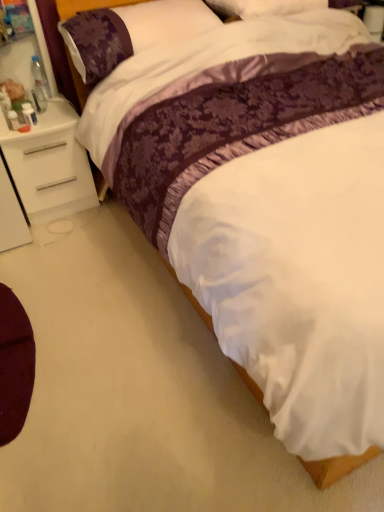
Question: Is maroon fabric cushion at lower left aimed at white matte nightstand at left?

Choices:
 (A) yes
 (B) no

Answer: (B)

Question: From the image's perspective, is maroon fabric cushion at lower left over white matte nightstand at left?

Choices:
 (A) yes
 (B) no

Answer: (B)

Question: Is maroon fabric cushion at lower left taller than white matte nightstand at left?

Choices:
 (A) yes
 (B) no

Answer: (B)

Question: Does maroon fabric cushion at lower left come in front of white matte nightstand at left?

Choices:
 (A) no
 (B) yes

Answer: (B)

Question: Is white matte nightstand at left at the back of maroon fabric cushion at lower left?

Choices:
 (A) no
 (B) yes

Answer: (A)

Question: Is maroon fabric cushion at lower left in front of or behind purple satin pillow at upper left in the image?

Choices:
 (A) behind
 (B) front

Answer: (B)

Question: Is maroon fabric cushion at lower left taller or shorter than purple satin pillow at upper left?

Choices:
 (A) tall
 (B) short

Answer: (B)

Question: From a real-world perspective, is maroon fabric cushion at lower left above or below purple satin pillow at upper left?

Choices:
 (A) above
 (B) below

Answer: (B)

Question: Which is correct: maroon fabric cushion at lower left is inside purple satin pillow at upper left, or outside of it?

Choices:
 (A) inside
 (B) outside

Answer: (B)

Question: Does point (160, 34) appear closer or farther from the camera than point (16, 104)?

Choices:
 (A) closer
 (B) farther

Answer: (A)

Question: Is purple satin pillow at upper left in front of or behind plush brown bear at left in the image?

Choices:
 (A) front
 (B) behind

Answer: (A)

Question: From their relative heights in the image, would you say purple satin pillow at upper left is taller or shorter than plush brown bear at left?

Choices:
 (A) short
 (B) tall

Answer: (B)

Question: From a real-world perspective, is purple satin pillow at upper left positioned above or below plush brown bear at left?

Choices:
 (A) below
 (B) above

Answer: (B)

Question: From the image's perspective, is maroon fabric cushion at lower left located above or below white matte nightstand at left?

Choices:
 (A) below
 (B) above

Answer: (A)

Question: In terms of size, does maroon fabric cushion at lower left appear bigger or smaller than white matte nightstand at left?

Choices:
 (A) small
 (B) big

Answer: (A)